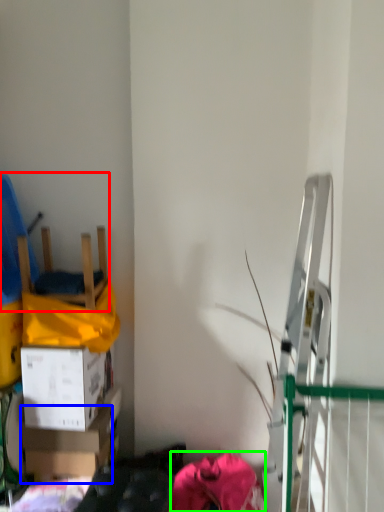
Question: Estimate the real-world distances between objects in this image. Which object is farther from chair (highlighted by a red box), box (highlighted by a blue box) or clothing (highlighted by a green box)?

Choices:
 (A) box
 (B) clothing

Answer: (B)